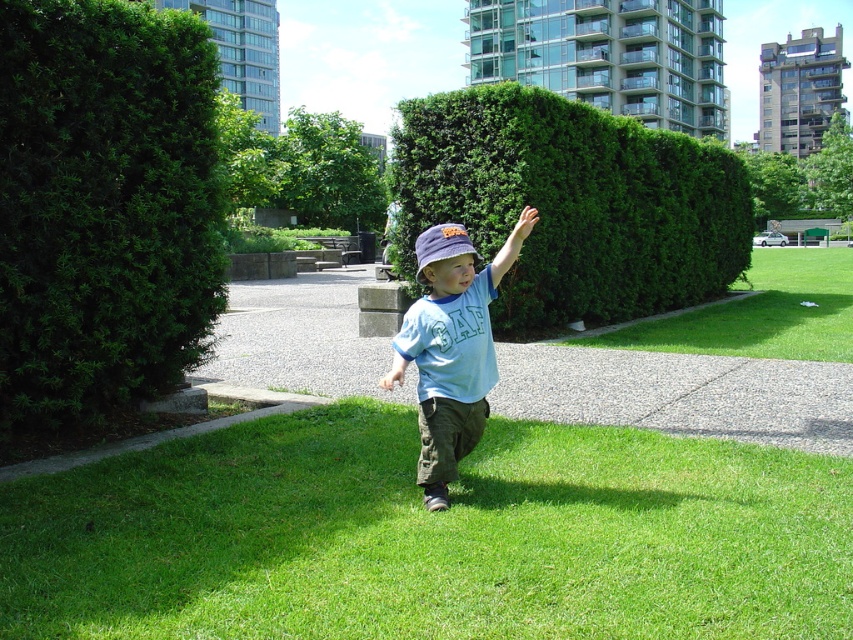
Is green leafy hedge at upper center to the right of light blue cotton shirt at center from the viewer's perspective?

Correct, you'll find green leafy hedge at upper center to the right of light blue cotton shirt at center.

The width and height of the screenshot is (853, 640). I want to click on green leafy hedge at upper center, so click(x=572, y=204).

Which is below, green grass at center or light blue cotton shirt at center?

Positioned lower is green grass at center.

Does green grass at center have a greater width compared to light blue cotton shirt at center?

Yes.

Find the location of `green grass at center`. green grass at center is located at coordinates (430, 536).

How far apart are green leafy bush at left and green leafy hedge at upper center?

green leafy bush at left is 6.06 meters from green leafy hedge at upper center.

Measure the distance between green leafy bush at left and green leafy hedge at upper center.

The distance of green leafy bush at left from green leafy hedge at upper center is 6.06 meters.

Is point (83, 310) in front of point (749, 195)?

Yes, point (83, 310) is in front of point (749, 195).

Where is `green leafy bush at left`? This screenshot has height=640, width=853. green leafy bush at left is located at coordinates (103, 205).